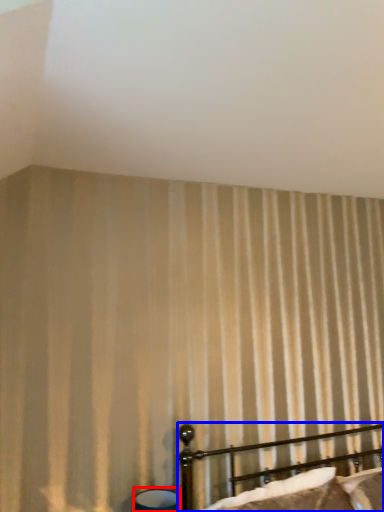
Question: Among these objects, which one is nearest to the camera, table lamp (highlighted by a red box) or bed (highlighted by a blue box)?

Choices:
 (A) table lamp
 (B) bed

Answer: (B)